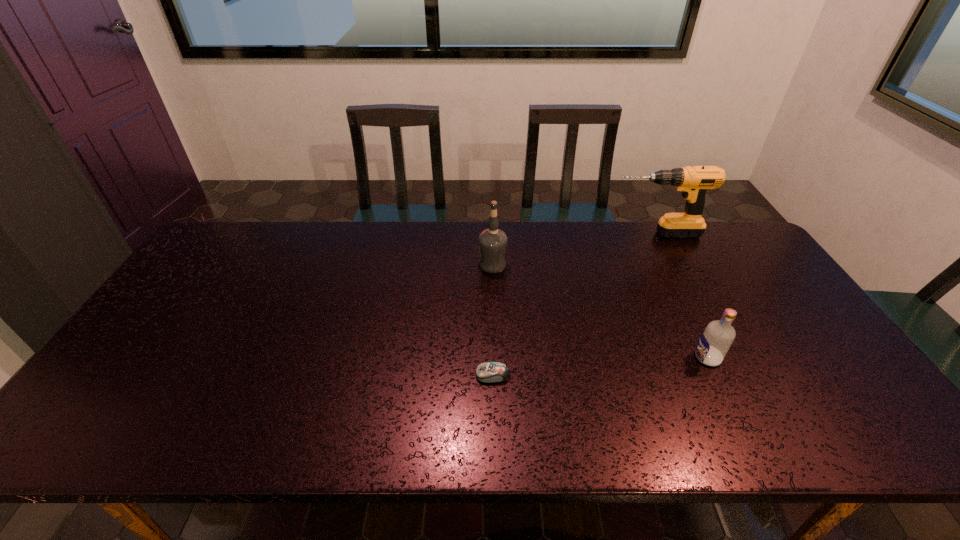
Locate an element on the screen. drill is located at coordinates (694, 181).

At what (x,y) coordinates should I click in order to perform the action: click on the left vodka. Please return your answer as a coordinate pair (x, y). This screenshot has height=540, width=960. Looking at the image, I should click on 492,242.

Find the location of a particular element. The width and height of the screenshot is (960, 540). the farther vodka is located at coordinates (492, 242).

The image size is (960, 540). I want to click on the right vodka, so click(x=716, y=339).

Where is `the shorter vodka`? The image size is (960, 540). the shorter vodka is located at coordinates [x=716, y=339].

The width and height of the screenshot is (960, 540). In order to click on computer mouse in this screenshot , I will do `click(488, 372)`.

At what (x,y) coordinates should I click in order to perform the action: click on vacant space situated 0.220m at the tip of the farthest object. Please return your answer as a coordinate pair (x, y). This screenshot has width=960, height=540. Looking at the image, I should click on (546, 233).

Where is `vacant space located 0.320m at the tip of the farthest object`? This screenshot has width=960, height=540. vacant space located 0.320m at the tip of the farthest object is located at coordinates (517, 233).

Where is `vacant space located 0.320m at the tip of the farthest object`? vacant space located 0.320m at the tip of the farthest object is located at coordinates point(517,233).

Find the location of `free space located 0.130m on the front label of the taller vodka`. free space located 0.130m on the front label of the taller vodka is located at coordinates (438, 264).